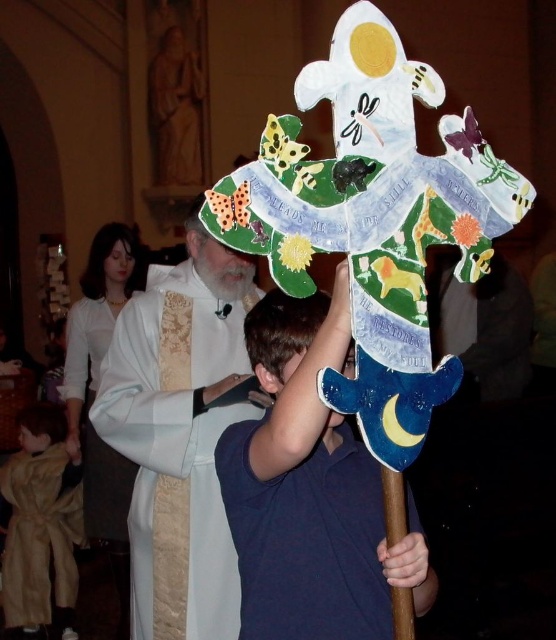
Question: Which object is closer to the camera taking this photo?

Choices:
 (A) light brown plush robe at lower left
 (B) blue paper shield at center

Answer: (B)

Question: Which of the following is the farthest from the observer?

Choices:
 (A) (152, 422)
 (B) (301, 387)
 (C) (48, 474)

Answer: (C)

Question: Which object is positioned farthest from the light brown plush robe at lower left?

Choices:
 (A) white clothed figure at center
 (B) white silk robe at left

Answer: (A)

Question: Is light brown plush robe at lower left wider than white silk robe at left?

Choices:
 (A) no
 (B) yes

Answer: (B)

Question: Is white clothed figure at center smaller than white silk robe at left?

Choices:
 (A) no
 (B) yes

Answer: (A)

Question: Is blue paper shield at center closer to camera compared to white silk robe at left?

Choices:
 (A) no
 (B) yes

Answer: (B)